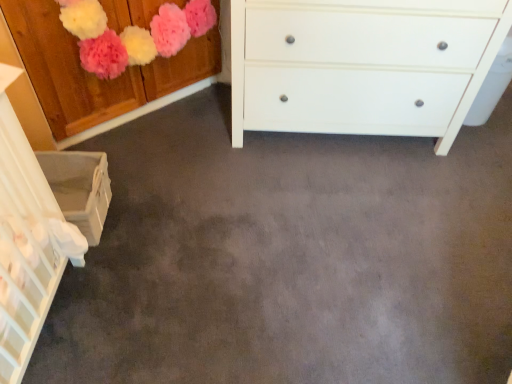
Identify the location of white matte chest of drawers at center. Image resolution: width=512 pixels, height=384 pixels. (361, 65).

Where is `wooden cabinet at upper left, the second cabinetry in the bottom-to-top sequence`? wooden cabinet at upper left, the second cabinetry in the bottom-to-top sequence is located at coordinates (102, 60).

You are a GUI agent. You are given a task and a screenshot of the screen. Output one action in this format:
    pyautogui.click(x=<x>, y=<y>)
    Task: Click on the white woven basket at lower left, the 1th cabinetry ordered from the bottom
    The height and width of the screenshot is (384, 512).
    Given the screenshot: What is the action you would take?
    pyautogui.click(x=79, y=188)

In terms of size, does white woven basket at lower left, the 1th cabinetry ordered from the bottom, appear bigger or smaller than wooden cabinet at upper left, the second cabinetry in the bottom-to-top sequence?

white woven basket at lower left, the 1th cabinetry ordered from the bottom, is smaller than wooden cabinet at upper left, the second cabinetry in the bottom-to-top sequence.

Does point (69, 199) come farther from viewer compared to point (116, 84)?

No, it is in front of (116, 84).

From the picture: Which object is further away from the camera taking this photo, white woven basket at lower left, which is the 2th cabinetry from top to bottom, or wooden cabinet at upper left, the second cabinetry in the bottom-to-top sequence?

white woven basket at lower left, which is the 2th cabinetry from top to bottom, is further away from the camera.

Is wooden cabinet at upper left, the 1th cabinetry positioned from the top, located within white woven basket at lower left, the 1th cabinetry ordered from the bottom?

Answer: Definitely not — wooden cabinet at upper left, the 1th cabinetry positioned from the top, is not inside white woven basket at lower left, the 1th cabinetry ordered from the bottom.

Would you say white matte chest of drawers at center is inside or outside wooden cabinet at upper left, the second cabinetry in the bottom-to-top sequence?

white matte chest of drawers at center is outside wooden cabinet at upper left, the second cabinetry in the bottom-to-top sequence.

Is white matte chest of drawers at center shorter than wooden cabinet at upper left, the second cabinetry in the bottom-to-top sequence?

No.

Which of these two, white matte chest of drawers at center or wooden cabinet at upper left, the second cabinetry in the bottom-to-top sequence, is thinner?

Thinner between the two is wooden cabinet at upper left, the second cabinetry in the bottom-to-top sequence.

Are white matte chest of drawers at center and wooden cabinet at upper left, the second cabinetry in the bottom-to-top sequence, making contact?

No, white matte chest of drawers at center is not next to wooden cabinet at upper left, the second cabinetry in the bottom-to-top sequence.

Who is smaller, wooden cabinet at upper left, the second cabinetry in the bottom-to-top sequence, or white matte chest of drawers at center?

With smaller size is wooden cabinet at upper left, the second cabinetry in the bottom-to-top sequence.

In terms of height, does wooden cabinet at upper left, the 1th cabinetry positioned from the top, look taller or shorter compared to white matte chest of drawers at center?

Considering their sizes, wooden cabinet at upper left, the 1th cabinetry positioned from the top, has less height than white matte chest of drawers at center.

In order to click on cabinetry above the white matte chest of drawers at center (from a real-world perspective) in this screenshot , I will do `click(102, 60)`.

Does wooden cabinet at upper left, the 1th cabinetry positioned from the top, have a greater width compared to white woven basket at lower left, which is the 2th cabinetry from top to bottom?

Incorrect, the width of wooden cabinet at upper left, the 1th cabinetry positioned from the top, does not surpass that of white woven basket at lower left, which is the 2th cabinetry from top to bottom.

Is wooden cabinet at upper left, the second cabinetry in the bottom-to-top sequence, bigger or smaller than white woven basket at lower left, which is the 2th cabinetry from top to bottom?

In the image, wooden cabinet at upper left, the second cabinetry in the bottom-to-top sequence, appears to be larger than white woven basket at lower left, which is the 2th cabinetry from top to bottom.

Does wooden cabinet at upper left, the second cabinetry in the bottom-to-top sequence, turn towards white woven basket at lower left, the 1th cabinetry ordered from the bottom?

No, wooden cabinet at upper left, the second cabinetry in the bottom-to-top sequence, does not turn towards white woven basket at lower left, the 1th cabinetry ordered from the bottom.

Is white woven basket at lower left, which is the 2th cabinetry from top to bottom, facing away from white matte chest of drawers at center?

white woven basket at lower left, which is the 2th cabinetry from top to bottom, is not turned away from white matte chest of drawers at center.

From the image's perspective, which one is positioned higher, white woven basket at lower left, which is the 2th cabinetry from top to bottom, or white matte chest of drawers at center?

white matte chest of drawers at center, from the image's perspective.

Between white woven basket at lower left, the 1th cabinetry ordered from the bottom, and white matte chest of drawers at center, which one has less height?

Standing shorter between the two is white woven basket at lower left, the 1th cabinetry ordered from the bottom.

Consider the image. Considering the sizes of white woven basket at lower left, which is the 2th cabinetry from top to bottom, and white matte chest of drawers at center in the image, is white woven basket at lower left, which is the 2th cabinetry from top to bottom, wider or thinner than white matte chest of drawers at center?

white woven basket at lower left, which is the 2th cabinetry from top to bottom, is thinner than white matte chest of drawers at center.

Which object is positioned more to the left, white matte chest of drawers at center or white woven basket at lower left, which is the 2th cabinetry from top to bottom?

From the viewer's perspective, white woven basket at lower left, which is the 2th cabinetry from top to bottom, appears more on the left side.

There is a white woven basket at lower left, the 1th cabinetry ordered from the bottom. Where is `the chest of drawers above it (from a real-world perspective)`? the chest of drawers above it (from a real-world perspective) is located at coordinates (361, 65).

Is white matte chest of drawers at center turned away from white woven basket at lower left, the 1th cabinetry ordered from the bottom?

No, white matte chest of drawers at center is not facing the opposite direction of white woven basket at lower left, the 1th cabinetry ordered from the bottom.

This screenshot has height=384, width=512. I want to click on cabinetry on the left side of wooden cabinet at upper left, the 1th cabinetry positioned from the top, so click(79, 188).

Identify the location of the chest of drawers behind the wooden cabinet at upper left, the second cabinetry in the bottom-to-top sequence. (361, 65).

Estimate the real-world distances between objects in this image. Which object is further from white woven basket at lower left, which is the 2th cabinetry from top to bottom, white matte chest of drawers at center or wooden cabinet at upper left, the second cabinetry in the bottom-to-top sequence?

Among the two, white matte chest of drawers at center is located further to white woven basket at lower left, which is the 2th cabinetry from top to bottom.

Looking at the image, which one is located closer to wooden cabinet at upper left, the 1th cabinetry positioned from the top, white woven basket at lower left, which is the 2th cabinetry from top to bottom, or white matte chest of drawers at center?

white woven basket at lower left, which is the 2th cabinetry from top to bottom, is closer to wooden cabinet at upper left, the 1th cabinetry positioned from the top.

Which object lies nearer to the anchor point wooden cabinet at upper left, the 1th cabinetry positioned from the top, white matte chest of drawers at center or white woven basket at lower left, which is the 2th cabinetry from top to bottom?

Among the two, white woven basket at lower left, which is the 2th cabinetry from top to bottom, is located nearer to wooden cabinet at upper left, the 1th cabinetry positioned from the top.

Based on their spatial positions, is wooden cabinet at upper left, the second cabinetry in the bottom-to-top sequence, or white woven basket at lower left, which is the 2th cabinetry from top to bottom, closer to white matte chest of drawers at center?

The object closer to white matte chest of drawers at center is wooden cabinet at upper left, the second cabinetry in the bottom-to-top sequence.

Estimate the real-world distances between objects in this image. Which object is closer to white woven basket at lower left, which is the 2th cabinetry from top to bottom, wooden cabinet at upper left, the second cabinetry in the bottom-to-top sequence, or white matte chest of drawers at center?

wooden cabinet at upper left, the second cabinetry in the bottom-to-top sequence.

From the picture: Which object lies nearer to the anchor point white matte chest of drawers at center, white woven basket at lower left, which is the 2th cabinetry from top to bottom, or wooden cabinet at upper left, the 1th cabinetry positioned from the top?

wooden cabinet at upper left, the 1th cabinetry positioned from the top, lies closer to white matte chest of drawers at center than the other object.

You are a GUI agent. You are given a task and a screenshot of the screen. Output one action in this format:
    pyautogui.click(x=<x>, y=<y>)
    Task: Click on the cabinetry located between white woven basket at lower left, the 1th cabinetry ordered from the bottom, and white matte chest of drawers at center in the left-right direction
    
    Given the screenshot: What is the action you would take?
    pyautogui.click(x=102, y=60)